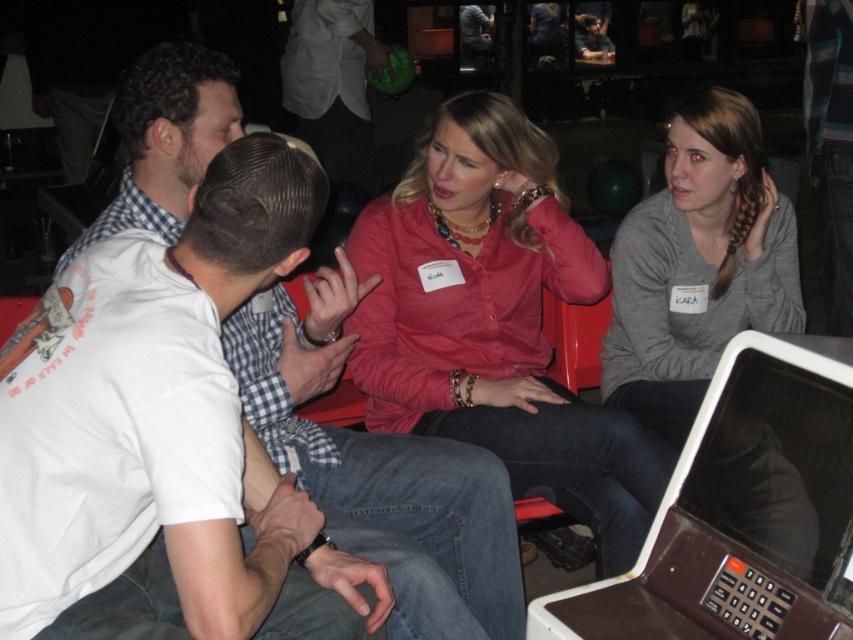
Is matte pink blouse at center bigger than white cotton t-shirt at center?

No, matte pink blouse at center is not bigger than white cotton t-shirt at center.

This screenshot has width=853, height=640. Identify the location of matte pink blouse at center. (495, 321).

Is white cotton t-shirt at center closer to the viewer compared to brown plastic laptop at lower right?

No, it is behind brown plastic laptop at lower right.

Who is higher up, white cotton t-shirt at center or brown plastic laptop at lower right?

Positioned higher is white cotton t-shirt at center.

Between point (444, 529) and point (831, 486), which one is positioned behind?

Positioned behind is point (444, 529).

I want to click on white cotton t-shirt at center, so click(380, 472).

Is matte pink blouse at center to the left of brown plastic laptop at lower right from the viewer's perspective?

Correct, you'll find matte pink blouse at center to the left of brown plastic laptop at lower right.

Between point (355, 237) and point (732, 488), which one is positioned behind?

Positioned behind is point (355, 237).

I want to click on matte pink blouse at center, so click(495, 321).

The width and height of the screenshot is (853, 640). In order to click on matte pink blouse at center in this screenshot , I will do `click(495, 321)`.